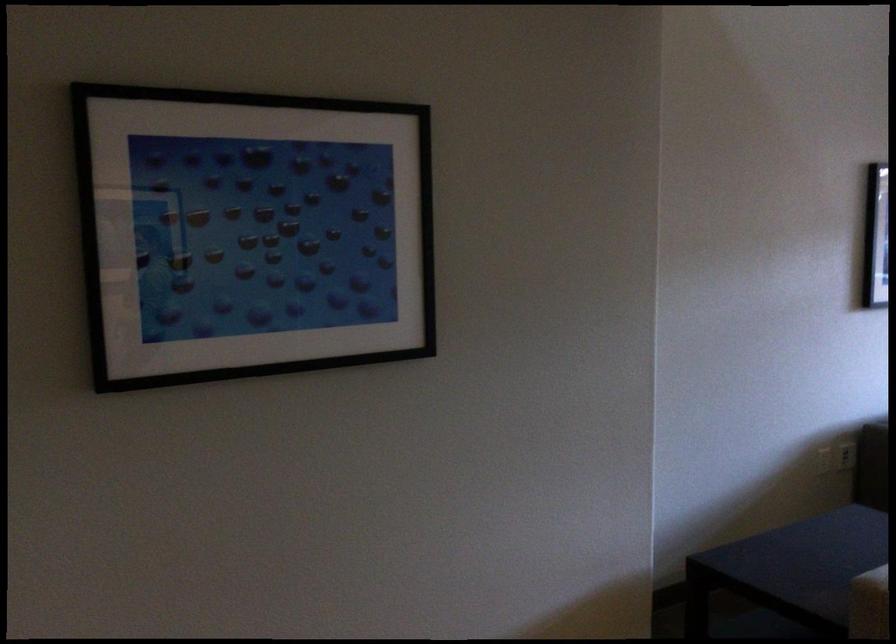
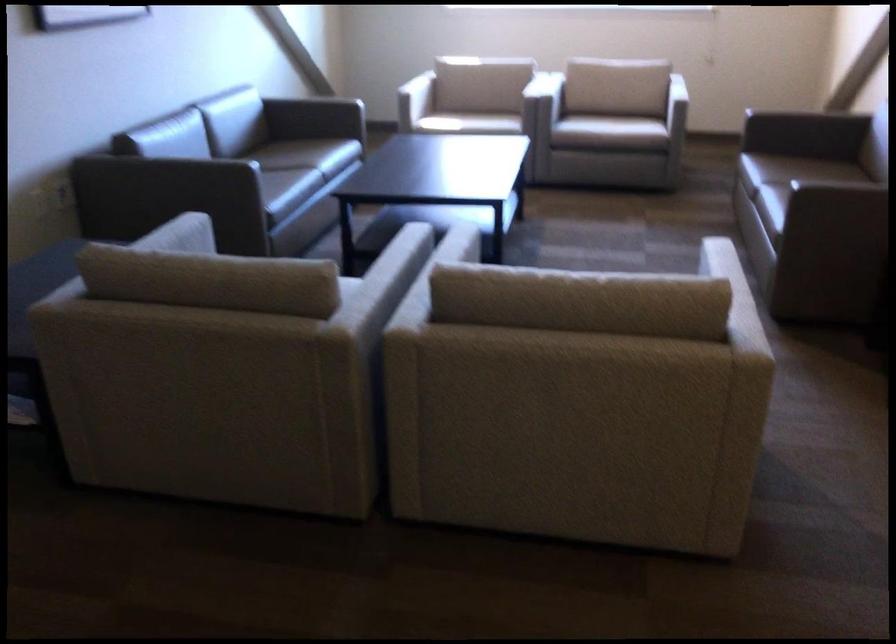
First-person continuous shooting, in which direction is the camera rotating?

The rotation direction of the camera is right-down.